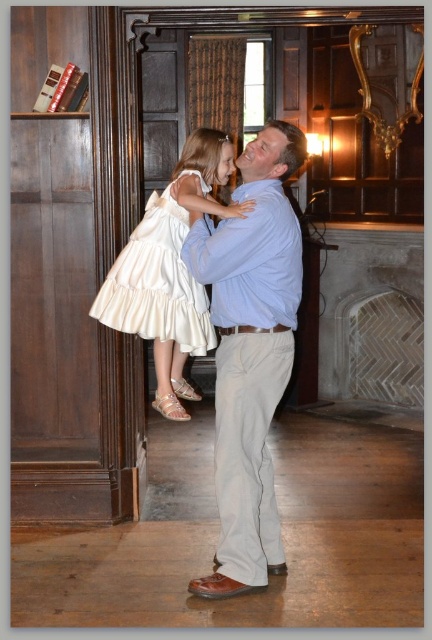
Is the position of light blue shirt at center less distant than that of white satin dress at center?

Yes, light blue shirt at center is closer to the viewer.

Which is more to the right, light blue shirt at center or white satin dress at center?

light blue shirt at center

Which is in front, point (260, 275) or point (172, 342)?

Positioned in front is point (260, 275).

Identify the location of light blue shirt at center. Image resolution: width=432 pixels, height=640 pixels. (250, 353).

Which is below, light blue shirt at center or ivory satin dress at center?

Positioned lower is light blue shirt at center.

Looking at this image, can you confirm if light blue shirt at center is positioned to the right of ivory satin dress at center?

Yes, light blue shirt at center is to the right of ivory satin dress at center.

Is point (261, 268) positioned before point (172, 248)?

Yes, it is.

This screenshot has width=432, height=640. In order to click on light blue shirt at center in this screenshot , I will do `click(250, 353)`.

Which of these two, white satin dress at center or ivory satin dress at center, stands shorter?

ivory satin dress at center is shorter.

What do you see at coordinates (170, 272) in the screenshot?
I see `white satin dress at center` at bounding box center [170, 272].

The image size is (432, 640). Identify the location of white satin dress at center. (170, 272).